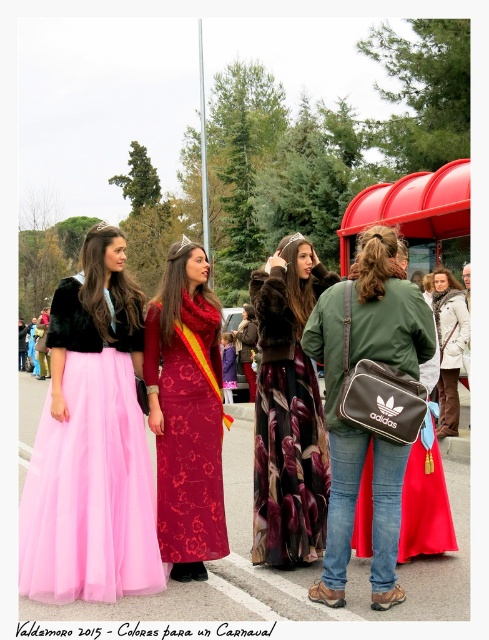
You are standing at the viewpoint of the image and want to know how far you are from the point marked at coordinates point (404, 426). Can you determine the distance?

The distance between you and the point marked at coordinates point (404, 426) is 21.95 feet.

You are a photographer trying to capture a clear shot of the green fabric jacket at center and the red plastic bus stop at center right. Which object appears narrower in the photo?

The green fabric jacket at center appears narrower than the red plastic bus stop at center right because it is thinner.